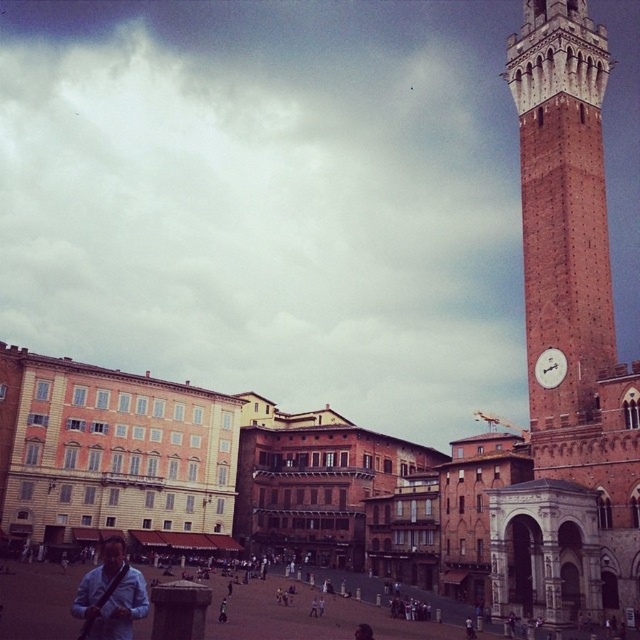
Which is above, brick clock tower at right or white glossy clock at upper right?

Positioned higher is brick clock tower at right.

The width and height of the screenshot is (640, 640). What do you see at coordinates (563, 202) in the screenshot?
I see `brick clock tower at right` at bounding box center [563, 202].

Locate an element on the screen. The image size is (640, 640). brick clock tower at right is located at coordinates (563, 202).

Which is behind, point (316, 512) or point (88, 576)?

Positioned behind is point (316, 512).

This screenshot has width=640, height=640. Describe the element at coordinates (264, 483) in the screenshot. I see `matte brick town square at center` at that location.

Find the location of `matte brick town square at center`. matte brick town square at center is located at coordinates (264, 483).

Where is `brick clock tower at right`? The height and width of the screenshot is (640, 640). brick clock tower at right is located at coordinates (563, 202).

Does point (560, 291) lie behind point (97, 605)?

Yes, point (560, 291) is farther from viewer.

Identify the location of brick clock tower at right. The width and height of the screenshot is (640, 640). point(563,202).